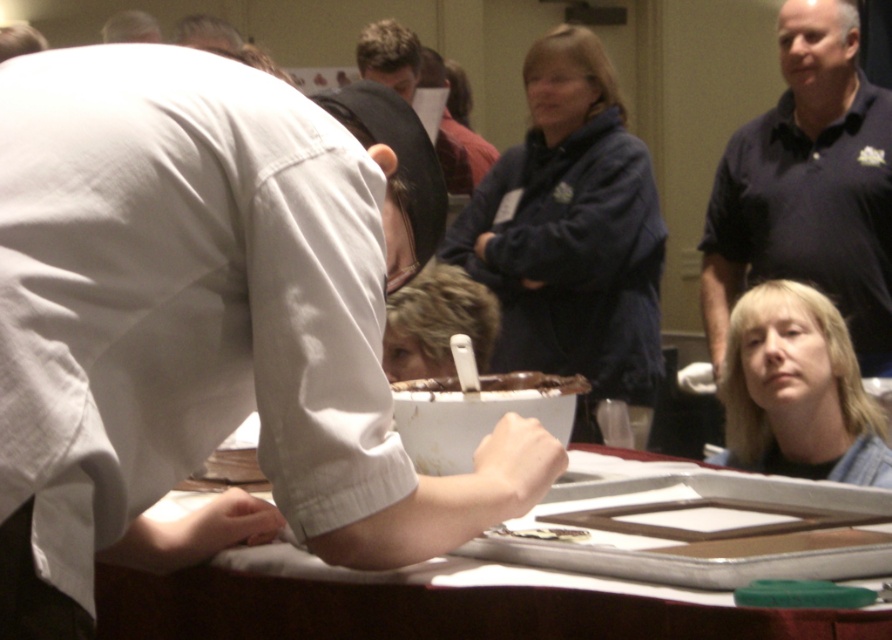
Question: Is white glossy tray at center further to the viewer compared to blonde hair at center?

Choices:
 (A) yes
 (B) no

Answer: (B)

Question: Estimate the real-world distances between objects in this image. Which object is closer to the dark blue polo shirt at upper right?

Choices:
 (A) white glossy tray at center
 (B) dark brown hair at upper center

Answer: (B)

Question: Which point is closer to the camera taking this photo?

Choices:
 (A) (529, 362)
 (B) (757, 310)
 (C) (765, 220)

Answer: (B)

Question: Based on their relative distances, which object is farther from the dark brown hair at upper center?

Choices:
 (A) blonde hair at lower right
 (B) dark blue polo shirt at upper right

Answer: (A)

Question: Is white glossy tray at center smaller than blonde hair at lower right?

Choices:
 (A) yes
 (B) no

Answer: (A)

Question: Does white glossy tray at center come behind dark brown hair at upper center?

Choices:
 (A) yes
 (B) no

Answer: (B)